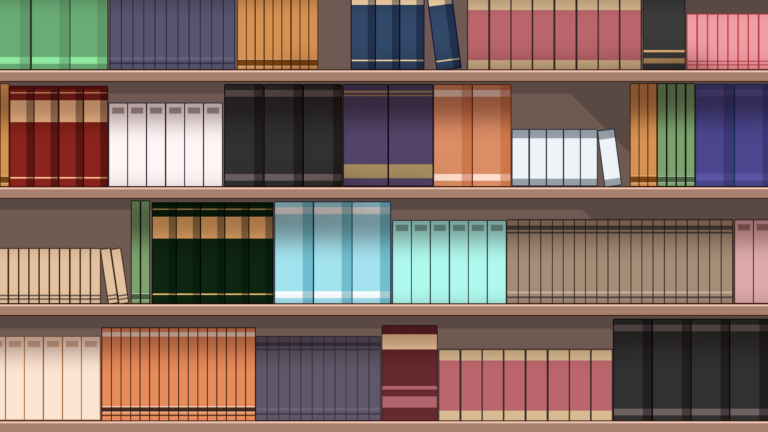
Locate an element on the screen. This screenshot has width=768, height=432. shelves is located at coordinates (434, 426), (405, 307), (386, 187), (412, 72).